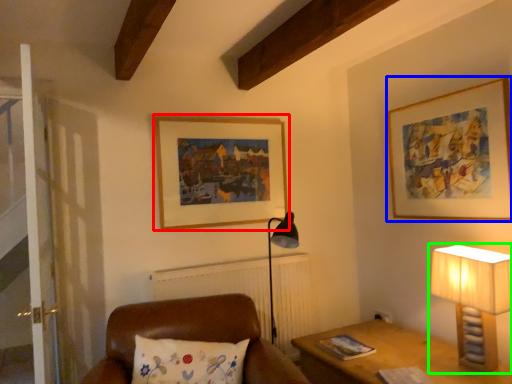
Question: Considering the real-world distances, which object is farthest from picture frame (highlighted by a red box)? picture frame (highlighted by a blue box) or lamp (highlighted by a green box)?

Choices:
 (A) picture frame
 (B) lamp

Answer: (B)